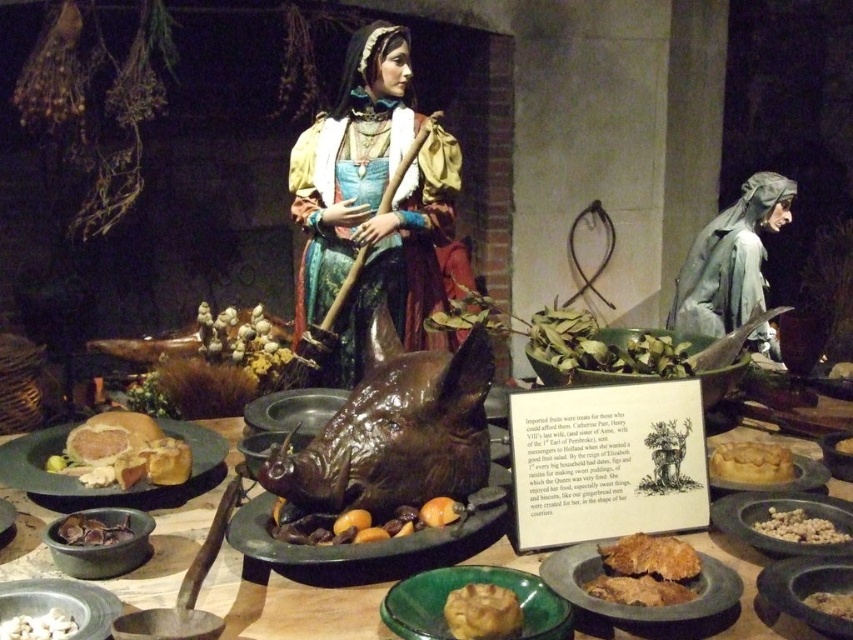
Who is positioned more to the right, golden brown crusty bread at center or shiny brown mushrooms at center?

Positioned to the right is shiny brown mushrooms at center.

Which of these two, golden brown crusty bread at center or shiny brown mushrooms at center, stands shorter?

shiny brown mushrooms at center is shorter.

This screenshot has width=853, height=640. What are the coordinates of `golden brown crusty bread at center` in the screenshot? It's located at (122, 452).

Between golden crispy pastry at center and matte gray bowl at lower left, which one appears on the left side from the viewer's perspective?

From the viewer's perspective, matte gray bowl at lower left appears more on the left side.

Which is below, golden crispy pastry at center or matte gray bowl at lower left?

matte gray bowl at lower left

Is point (607, 593) positioned after point (9, 580)?

No, (607, 593) is in front of (9, 580).

Where is `golden crispy pastry at center`? The image size is (853, 640). golden crispy pastry at center is located at coordinates [645, 570].

Is golden brown crusty bread at center above golden crumbly cake at center?

Yes.

Does point (132, 468) come closer to viewer compared to point (724, 458)?

Yes, it is.

Locate an element on the screen. golden brown crusty bread at center is located at coordinates (122, 452).